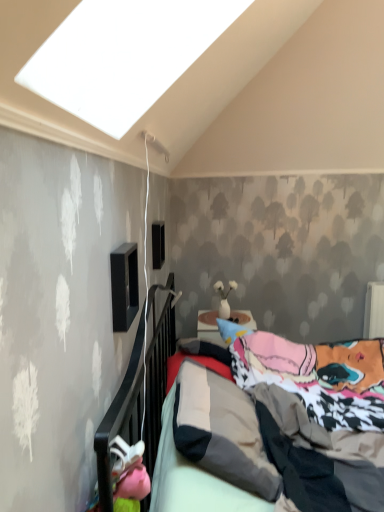
Question: Considering the relative positions of mattress at center and black matte speaker at upper left, arranged as the 1th window when viewed from the front, in the image provided, is mattress at center to the left or to the right of black matte speaker at upper left, arranged as the 1th window when viewed from the front,?

Choices:
 (A) left
 (B) right

Answer: (B)

Question: From a real-world perspective, is mattress at center above or below black matte speaker at upper left, arranged as the 1th window when viewed from the front?

Choices:
 (A) below
 (B) above

Answer: (A)

Question: Estimate the real-world distances between objects in this image. Which object is farther from the mattress at center?

Choices:
 (A) black matte window at upper center, which appears as the 1th window when viewed from the back
 (B) black matte speaker at upper left, which ranks as the second window in back-to-front order

Answer: (A)

Question: Considering the real-world distances, which object is farthest from the mattress at center?

Choices:
 (A) black matte speaker at upper left, which ranks as the second window in back-to-front order
 (B) black matte window at upper center, which appears as the 1th window when viewed from the back

Answer: (B)